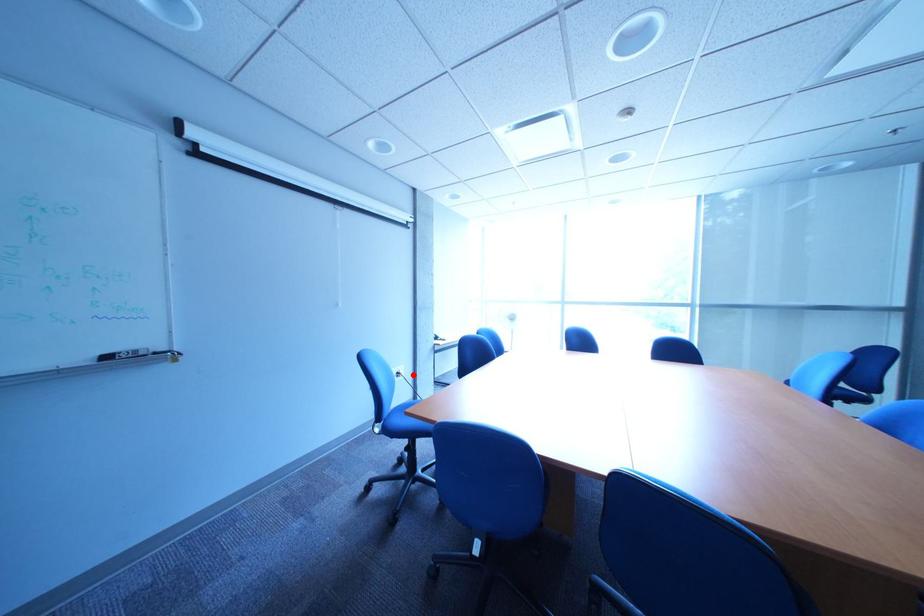
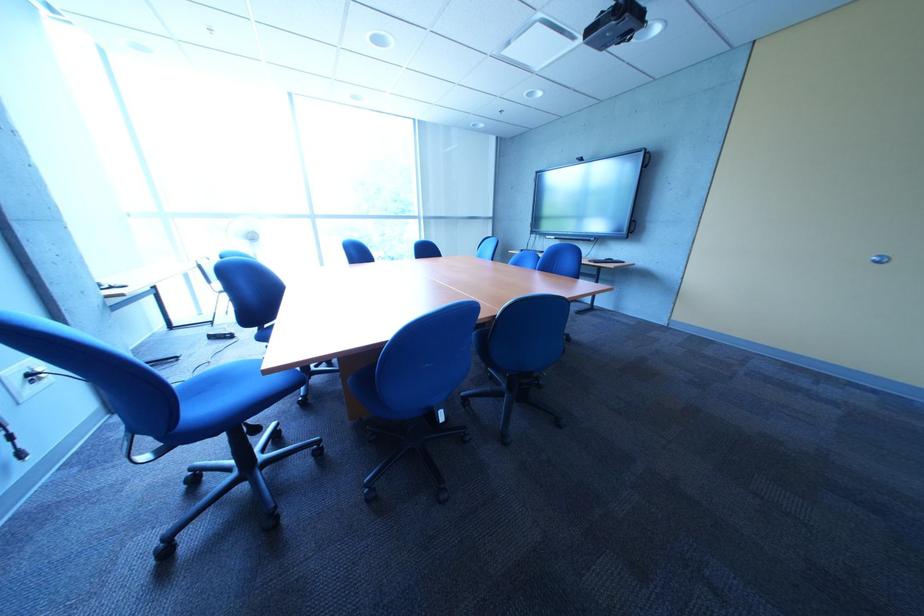
In the second image, find the point that corresponds to the highlighted location in the first image.

(46, 377)